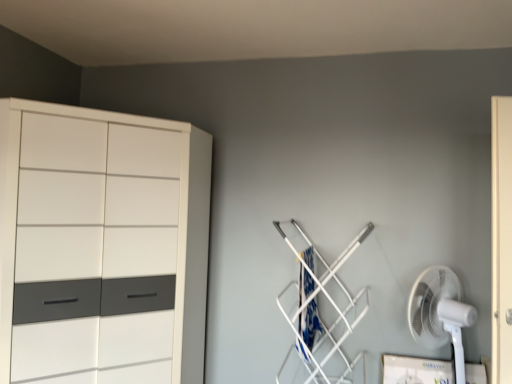
Question: Should I look upward or downward to see white glossy cupboard at left?

Choices:
 (A) down
 (B) up

Answer: (A)

Question: Considering the relative sizes of white glossy cupboard at left and blue fabric laundry at center-right in the image provided, is white glossy cupboard at left taller than blue fabric laundry at center-right?

Choices:
 (A) no
 (B) yes

Answer: (B)

Question: From the image's perspective, is white glossy cupboard at left below blue fabric laundry at center-right?

Choices:
 (A) no
 (B) yes

Answer: (A)

Question: Is white glossy cupboard at left positioned far away from blue fabric laundry at center-right?

Choices:
 (A) yes
 (B) no

Answer: (A)

Question: Can you confirm if white glossy cupboard at left is bigger than blue fabric laundry at center-right?

Choices:
 (A) no
 (B) yes

Answer: (B)

Question: From a real-world perspective, is white glossy cupboard at left below blue fabric laundry at center-right?

Choices:
 (A) yes
 (B) no

Answer: (B)

Question: Is white glossy cupboard at left next to blue fabric laundry at center-right?

Choices:
 (A) yes
 (B) no

Answer: (B)

Question: Can you confirm if blue fabric laundry at center-right is positioned to the left of white glossy cupboard at left?

Choices:
 (A) yes
 (B) no

Answer: (B)

Question: Can you confirm if blue fabric laundry at center-right is shorter than white glossy cupboard at left?

Choices:
 (A) no
 (B) yes

Answer: (B)

Question: From the image's perspective, does blue fabric laundry at center-right appear lower than white glossy cupboard at left?

Choices:
 (A) no
 (B) yes

Answer: (B)

Question: Is blue fabric laundry at center-right far away from white glossy cupboard at left?

Choices:
 (A) no
 (B) yes

Answer: (B)

Question: Is blue fabric laundry at center-right oriented towards white glossy cupboard at left?

Choices:
 (A) no
 (B) yes

Answer: (A)

Question: Could white glossy cupboard at left be considered to be inside blue fabric laundry at center-right?

Choices:
 (A) yes
 (B) no

Answer: (B)

Question: Can you confirm if white plastic fan at lower right is shorter than white glossy cupboard at left?

Choices:
 (A) yes
 (B) no

Answer: (A)